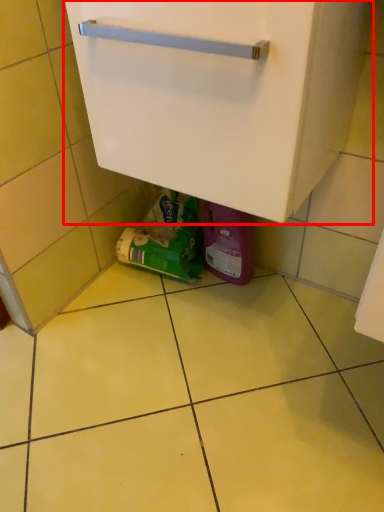
Question: From the image's perspective, where is cabinetry (annotated by the red box) located in relation to garbage in the image?

Choices:
 (A) above
 (B) below

Answer: (A)